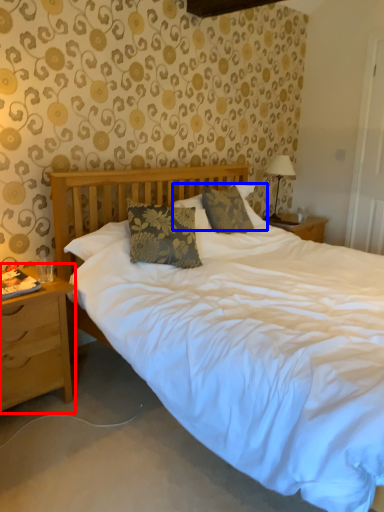
Question: Which object appears closest to the camera in this image, nightstand (highlighted by a red box) or pillow (highlighted by a blue box)?

Choices:
 (A) nightstand
 (B) pillow

Answer: (A)